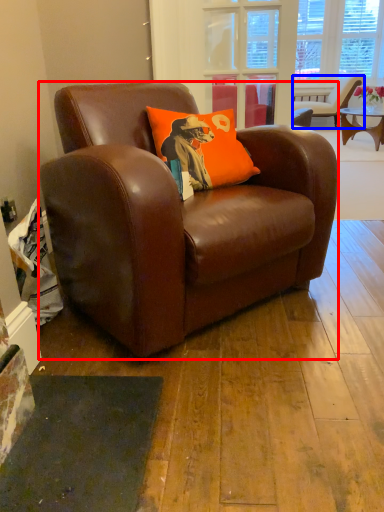
Question: Which point is further to the camera, chair (highlighted by a red box) or chair (highlighted by a blue box)?

Choices:
 (A) chair
 (B) chair

Answer: (B)